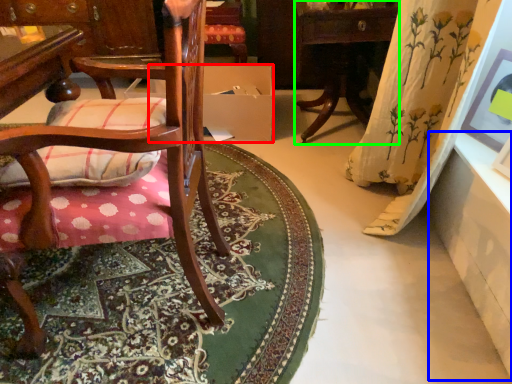
Question: Based on their relative distances, which object is farther from cardboard box (highlighted by a red box)? Choose from table (highlighted by a blue box) and table (highlighted by a green box).

Choices:
 (A) table
 (B) table

Answer: (A)